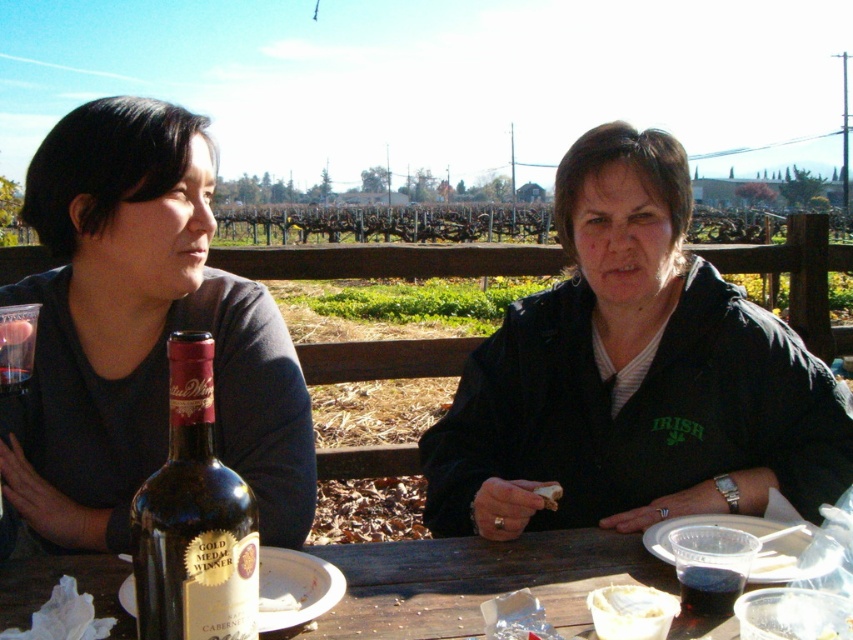
Question: Which of the following is the closest to the observer?

Choices:
 (A) dark purple liquid at lower right
 (B) white creamy bowl at lower center
 (C) dark glass bottle at center

Answer: (C)

Question: Considering the relative positions of dark glass bottle at center and white creamy cheese at center in the image provided, where is dark glass bottle at center located with respect to white creamy cheese at center?

Choices:
 (A) right
 (B) left

Answer: (B)

Question: Which point is closer to the camera taking this photo?

Choices:
 (A) (16, 333)
 (B) (730, 602)
 (C) (213, 376)

Answer: (C)

Question: Can you confirm if black matte jacket at center is bigger than dark red liquid at table center?

Choices:
 (A) no
 (B) yes

Answer: (B)

Question: Considering the relative positions of matte black jacket at center and white creamy bowl at lower center in the image provided, where is matte black jacket at center located with respect to white creamy bowl at lower center?

Choices:
 (A) right
 (B) left

Answer: (B)

Question: Which point is closer to the camera?

Choices:
 (A) (602, 628)
 (B) (759, 566)
 (C) (30, 326)

Answer: (A)